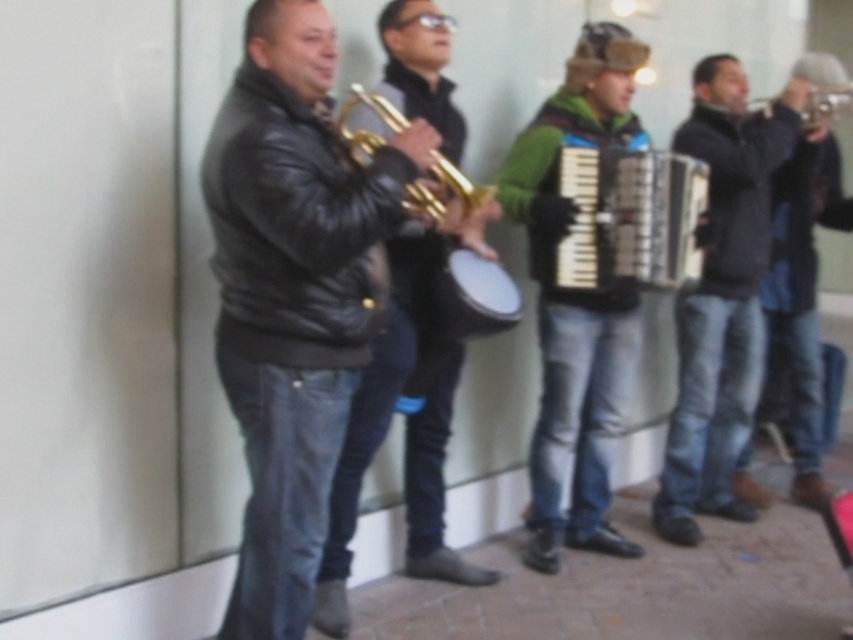
Which of these two, dark blue jeans at center or gold shiny trumpet at center, stands shorter?

gold shiny trumpet at center

Image resolution: width=853 pixels, height=640 pixels. Find the location of `dark blue jeans at center`. dark blue jeans at center is located at coordinates (724, 291).

Between dark blue jeans at center and dark brown leather jacket at right, which one is positioned higher?

Positioned higher is dark brown leather jacket at right.

Who is more distant from viewer, (685,328) or (798,269)?

Point (798,269)

Is point (717, 253) more distant than point (776, 321)?

No, it is in front of (776, 321).

At what (x,y) coordinates should I click in order to perform the action: click on dark blue jeans at center. Please return your answer as a coordinate pair (x, y). The image size is (853, 640). Looking at the image, I should click on (724, 291).

Is dark brown leather jacket at right bigger than gold shiny trumpet at center?

Yes, dark brown leather jacket at right is bigger than gold shiny trumpet at center.

Which is below, dark brown leather jacket at right or gold shiny trumpet at center?

dark brown leather jacket at right is below.

Is point (804, 355) positioned before point (399, 128)?

No, (804, 355) is behind (399, 128).

Where is `dark brown leather jacket at right`? The image size is (853, 640). dark brown leather jacket at right is located at coordinates (799, 310).